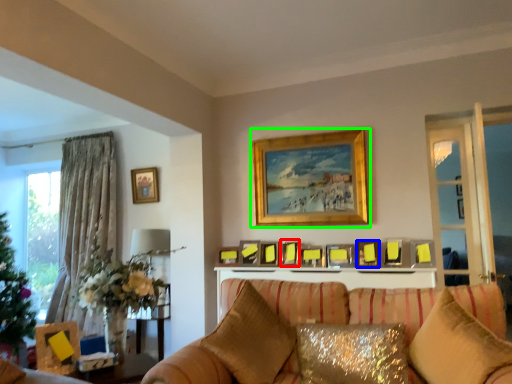
Question: Considering the real-world distances, which object is farthest from picture frame (highlighted by a red box)? picture frame (highlighted by a blue box) or picture frame (highlighted by a green box)?

Choices:
 (A) picture frame
 (B) picture frame

Answer: (B)